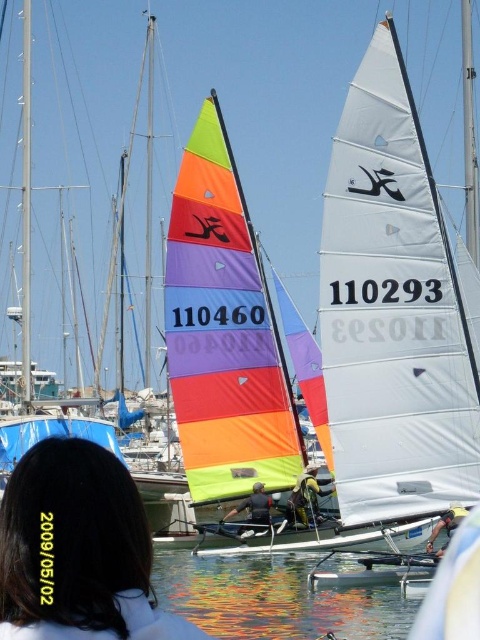
You are a photographer standing at the edge of the marina, wanting to capture a photo of the dark brown hair at center and camouflage fabric jacket at center in the same frame. Given that your camera has a maximum focus range of 150 feet, will you be able to include both subjects in the photo without moving closer?

The dark brown hair at center and camouflage fabric jacket at center are 147.07 feet apart. Since the distance between them is within the camera maximum focus range of 150 feet, you can include both subjects in the photo without moving closer.

You are standing on the dock at the marina and see the point marked at coordinates point [273,600]. What is located at that point?

The point [273,600] marks reflective water at lower center.